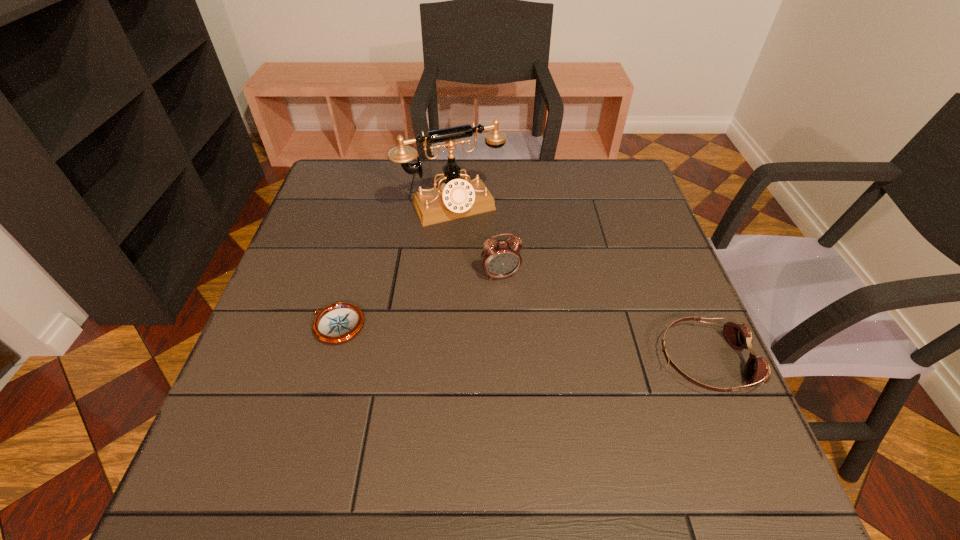
Where is `free space at the far edge of the desktop`? The width and height of the screenshot is (960, 540). free space at the far edge of the desktop is located at coordinates (424, 170).

In the image, there is a desktop. At what (x,y) coordinates should I click in order to perform the action: click on free space at the near edge. Please return your answer as a coordinate pair (x, y). The width and height of the screenshot is (960, 540). Looking at the image, I should click on (625, 402).

Image resolution: width=960 pixels, height=540 pixels. In order to click on free region at the left edge in this screenshot , I will do 338,215.

Where is `free space at the right edge of the desktop`? The height and width of the screenshot is (540, 960). free space at the right edge of the desktop is located at coordinates (611, 246).

Locate an element on the screen. vacant space at the far left corner of the desktop is located at coordinates (352, 160).

In order to click on vacant position at the far right corner of the desktop in this screenshot , I will do `click(645, 200)`.

The height and width of the screenshot is (540, 960). What are the coordinates of `unoccupied position between the second tallest object and the telephone` in the screenshot? It's located at (476, 241).

The height and width of the screenshot is (540, 960). I want to click on free space between the leftmost object and the third nearest object, so click(x=419, y=300).

Where is `free space between the second farthest object and the compass`? free space between the second farthest object and the compass is located at coordinates (419, 300).

Where is `free space between the goggles and the second tallest object`? The height and width of the screenshot is (540, 960). free space between the goggles and the second tallest object is located at coordinates (602, 318).